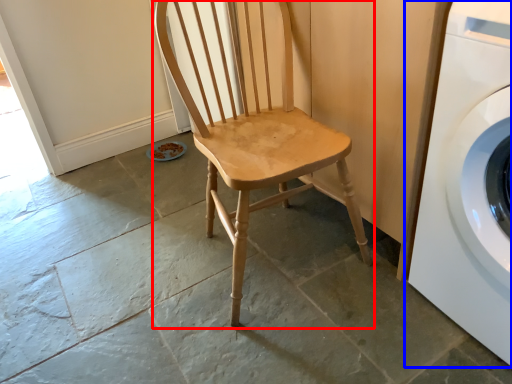
Question: Which of the following is the closest to the observer, chair (highlighted by a red box) or washing machine (highlighted by a blue box)?

Choices:
 (A) chair
 (B) washing machine

Answer: (B)